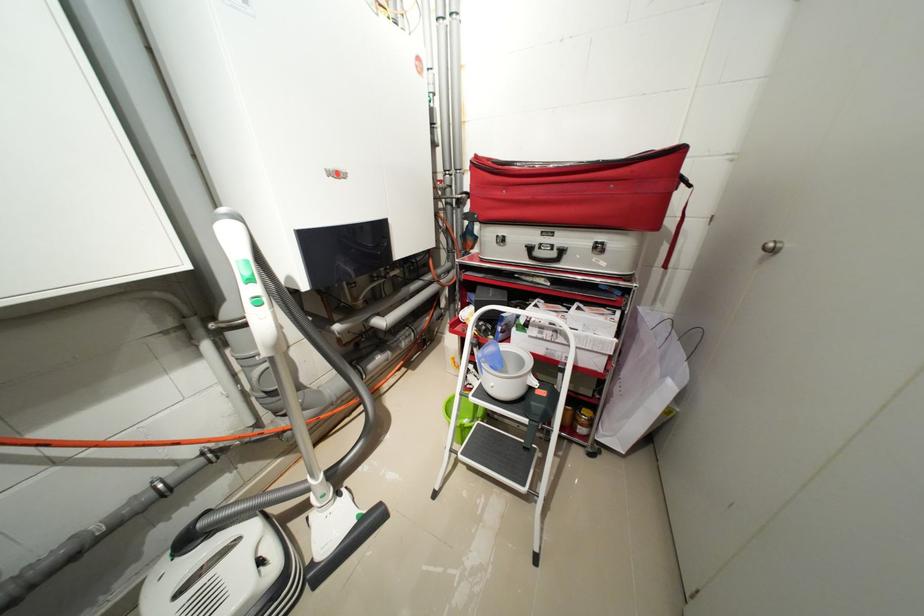
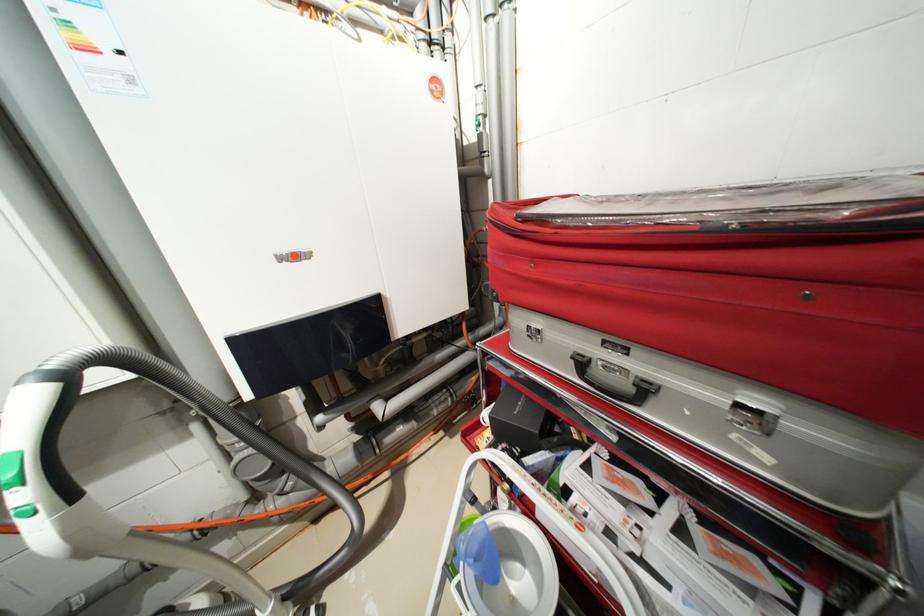
The point at (537, 249) is marked in the first image. Where is the corresponding point in the second image?

(589, 363)